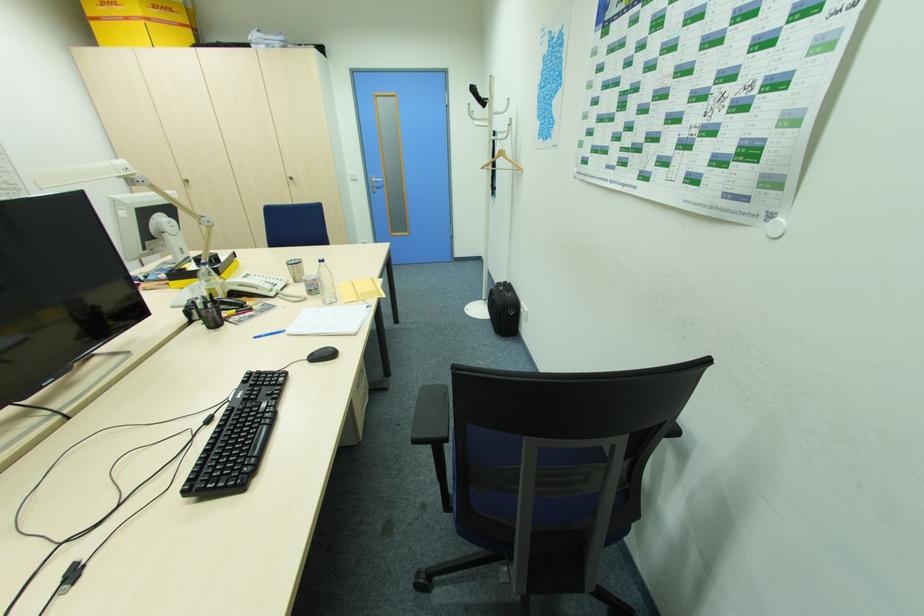
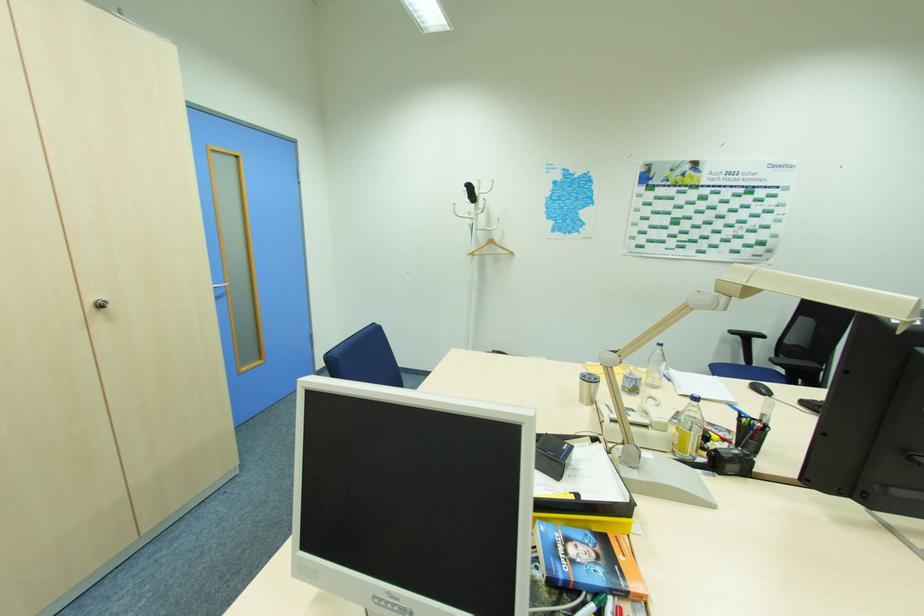
In the second image, find the point that corresponds to (x=485, y=168) in the first image.

(472, 254)